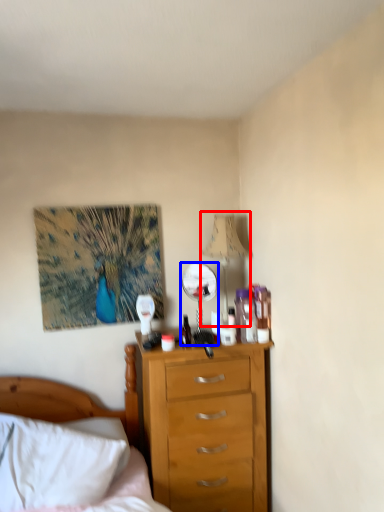
Question: Which object appears farthest to the camera in this image, lamp (highlighted by a red box) or mirror (highlighted by a blue box)?

Choices:
 (A) lamp
 (B) mirror

Answer: (B)